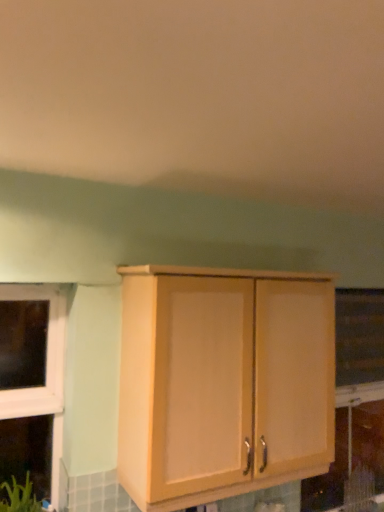
Question: Should I look upward or downward to see transparent plastic window screen at right?

Choices:
 (A) up
 (B) down

Answer: (B)

Question: Does light wood cabinet at center have a larger size compared to transparent plastic window screen at right?

Choices:
 (A) yes
 (B) no

Answer: (A)

Question: Would you say light wood cabinet at center is a long distance from transparent plastic window screen at right?

Choices:
 (A) no
 (B) yes

Answer: (B)

Question: Does light wood cabinet at center appear on the right side of transparent plastic window screen at right?

Choices:
 (A) no
 (B) yes

Answer: (A)

Question: Does light wood cabinet at center have a greater height compared to transparent plastic window screen at right?

Choices:
 (A) yes
 (B) no

Answer: (A)

Question: Is transparent plastic window screen at right located within light wood cabinet at center?

Choices:
 (A) no
 (B) yes

Answer: (A)

Question: Does light wood cabinet at center have a lesser height compared to transparent plastic window screen at right?

Choices:
 (A) no
 (B) yes

Answer: (A)

Question: Does transparent plastic window screen at right appear on the left side of light wood cabinet at center?

Choices:
 (A) yes
 (B) no

Answer: (B)

Question: Does transparent plastic window screen at right come behind light wood cabinet at center?

Choices:
 (A) no
 (B) yes

Answer: (B)

Question: Is transparent plastic window screen at right next to light wood cabinet at center and touching it?

Choices:
 (A) no
 (B) yes

Answer: (A)

Question: Is transparent plastic window screen at right positioned with its back to light wood cabinet at center?

Choices:
 (A) no
 (B) yes

Answer: (A)

Question: Considering the relative sizes of transparent plastic window screen at right and light wood cabinet at center in the image provided, is transparent plastic window screen at right thinner than light wood cabinet at center?

Choices:
 (A) yes
 (B) no

Answer: (A)

Question: From a real-world perspective, is transparent plastic window screen at right on top of light wood cabinet at center?

Choices:
 (A) no
 (B) yes

Answer: (B)

Question: Looking at the image, does transparent plastic window screen at right seem bigger or smaller compared to light wood cabinet at center?

Choices:
 (A) big
 (B) small

Answer: (B)